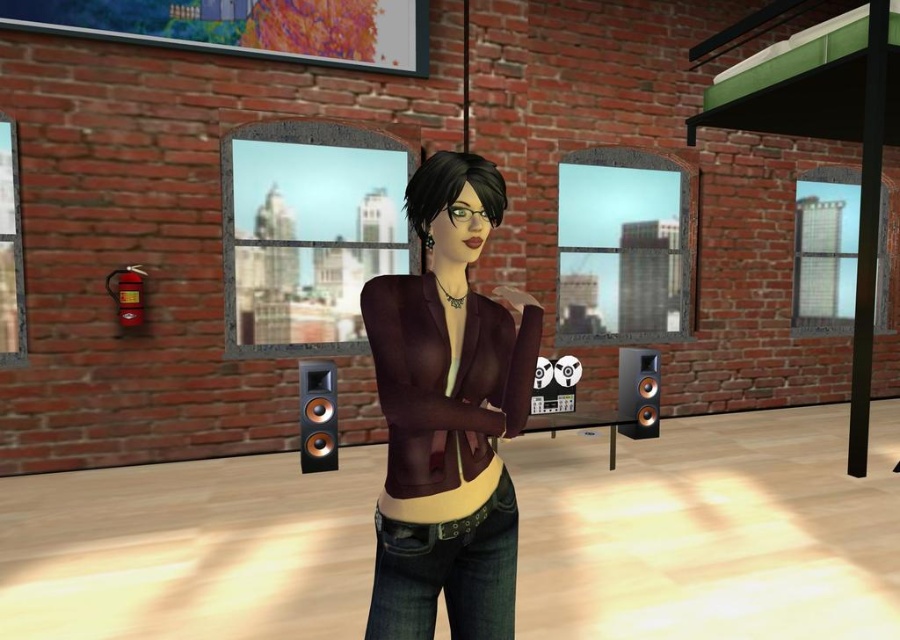
Which is below, matte brown blazer at center or glass window at center?

matte brown blazer at center is below.

At what (x,y) coordinates should I click in order to perform the action: click on matte brown blazer at center. Please return your answer as a coordinate pair (x, y). The image size is (900, 640). Looking at the image, I should click on (447, 416).

Locate an element on the screen. matte brown blazer at center is located at coordinates (447, 416).

Does matte brown blazer at center have a greater height compared to polished wood speaker at right?

Indeed, matte brown blazer at center has a greater height compared to polished wood speaker at right.

Is matte brown blazer at center wider than polished wood speaker at right?

Yes.

Identify the location of matte brown blazer at center. (447, 416).

You are a GUI agent. You are given a task and a screenshot of the screen. Output one action in this format:
    pyautogui.click(x=<x>, y=<y>)
    Task: Click on the matte brown blazer at center
    
    Given the screenshot: What is the action you would take?
    pyautogui.click(x=447, y=416)

How distant is matte glass window at center from glass window at center?

matte glass window at center and glass window at center are 48.94 feet apart from each other.

Is matte glass window at center above glass window at center?

Yes.

Locate an element on the screen. matte glass window at center is located at coordinates (308, 234).